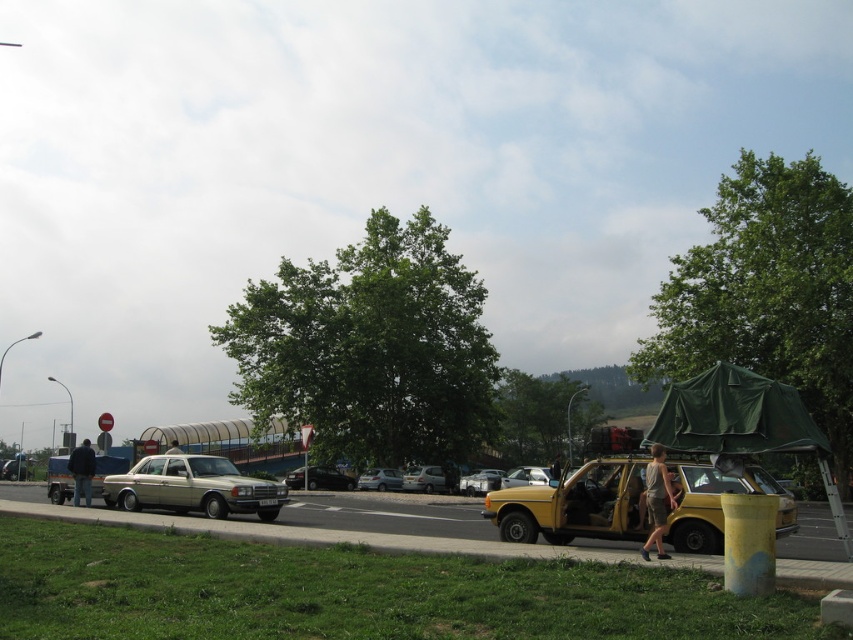
Is green grass at lower left further to the viewer compared to metallic silver sedan at center?

That is False.

Can you confirm if green grass at lower left is positioned above metallic silver sedan at center?

Yes, green grass at lower left is above metallic silver sedan at center.

Who is more distant from viewer, (70,509) or (474,492)?

Positioned behind is point (474,492).

Identify the location of green grass at lower left. The height and width of the screenshot is (640, 853). (351, 538).

Between metallic silver sedan at center and silver metallic sedan at left, which one appears on the right side from the viewer's perspective?

metallic silver sedan at center

Is metallic silver sedan at center wider than silver metallic sedan at left?

No, metallic silver sedan at center is not wider than silver metallic sedan at left.

Which is in front, point (474, 477) or point (10, 476)?

Point (474, 477) is in front.

I want to click on metallic silver sedan at center, so click(480, 481).

Who is more forward, (82,484) or (531,483)?

Positioned in front is point (82,484).

At what (x,y) coordinates should I click in order to perform the action: click on dark blue jeans at left. Please return your answer as a coordinate pair (x, y). Looking at the image, I should click on (82, 472).

Where is `dark blue jeans at left`? Image resolution: width=853 pixels, height=640 pixels. dark blue jeans at left is located at coordinates (82, 472).